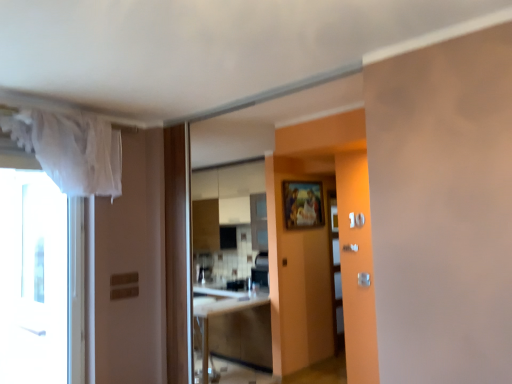
In order to click on blank space situated above wooden painted frame at center (from a real-world perspective) in this screenshot , I will do `click(303, 182)`.